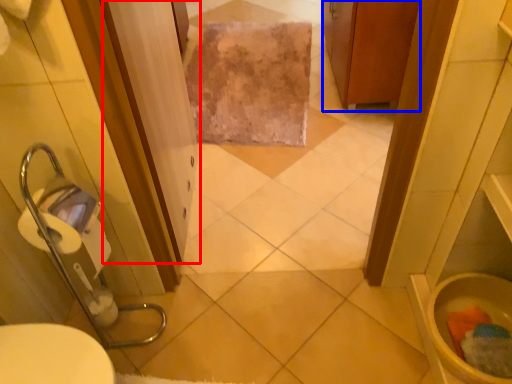
Question: Among these objects, which one is farthest to the camera, screen door (highlighted by a red box) or cabinetry (highlighted by a blue box)?

Choices:
 (A) screen door
 (B) cabinetry

Answer: (B)